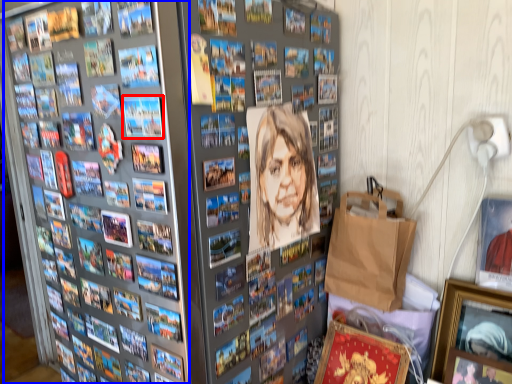
Question: Which object is further to the camera taking this photo, comic book (highlighted by a red box) or comic book (highlighted by a blue box)?

Choices:
 (A) comic book
 (B) comic book

Answer: (A)